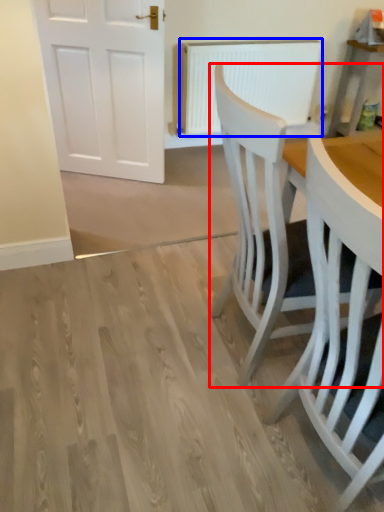
Question: Among these objects, which one is farthest to the camera, chair (highlighted by a red box) or radiator (highlighted by a blue box)?

Choices:
 (A) chair
 (B) radiator

Answer: (B)